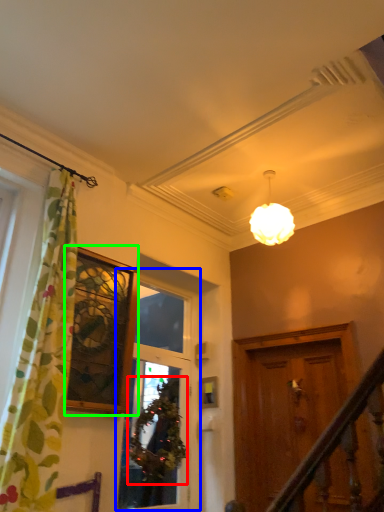
Question: Which is farther away from plant (highlighted by a red box)? window (highlighted by a blue box) or window (highlighted by a green box)?

Choices:
 (A) window
 (B) window

Answer: (B)